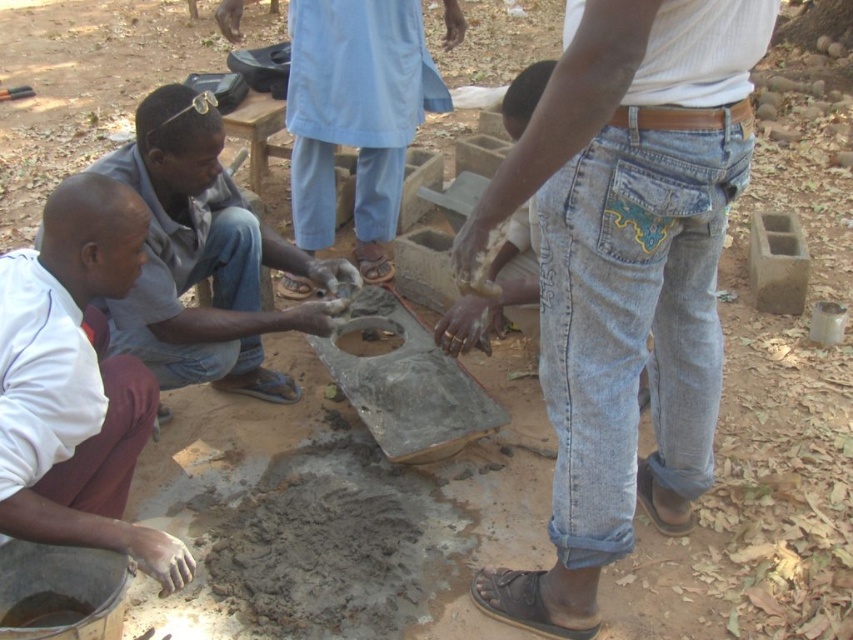
You are a construction worker who needs to place a new piece of concrete at the exact center of the current matte gray concrete at center. Where should you place it relative to the existing structure?

The matte gray concrete at center is already positioned at the center point, so placing the new piece there would mean it overlaps the existing matte gray concrete at center. You should adjust the placement to avoid overlap.